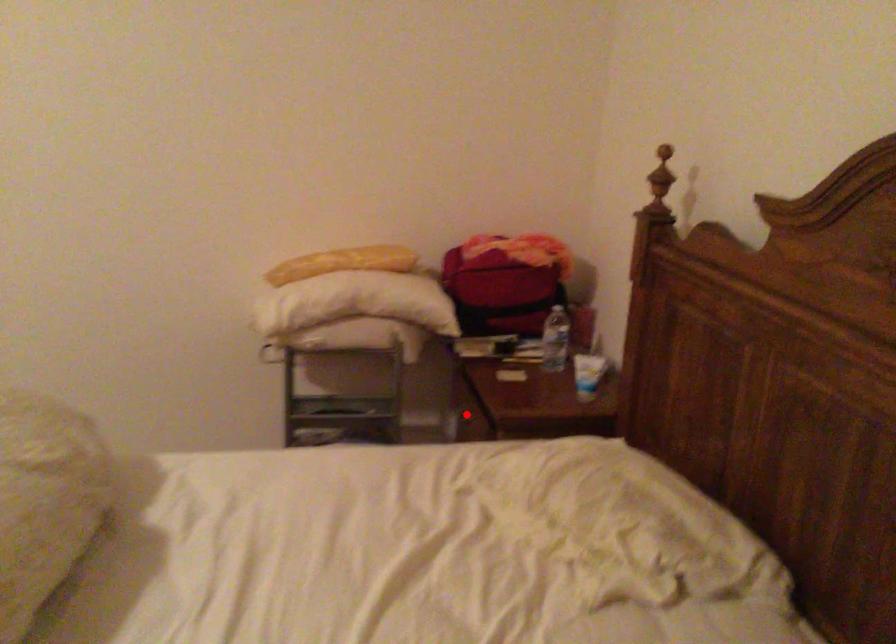
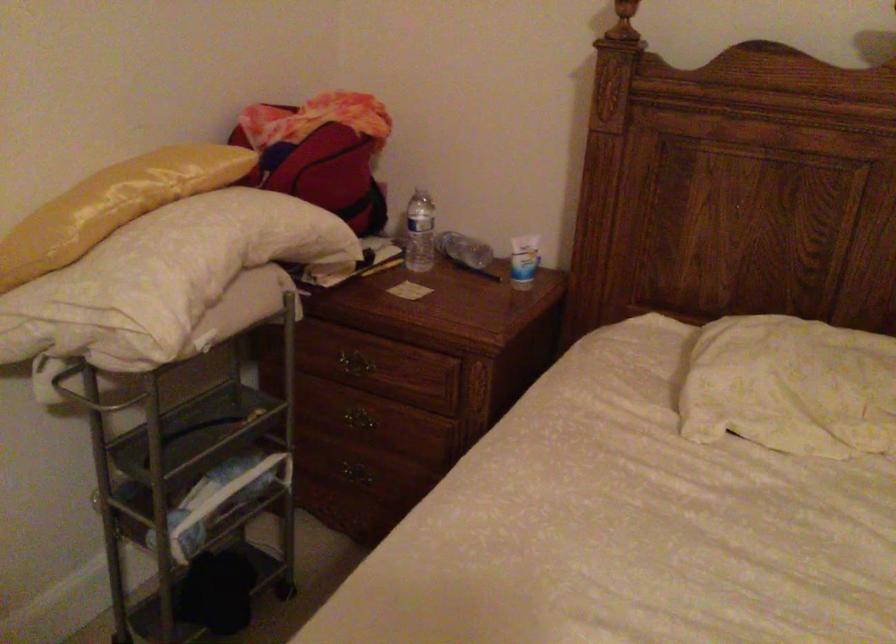
Question: I am providing you with two images of the same scene from different viewpoints. Given a red point in image1, look at the same physical point in image2. Is it:

Choices:
 (A) Closer to the viewpoint
 (B) Farther from the viewpoint

Answer: (A)